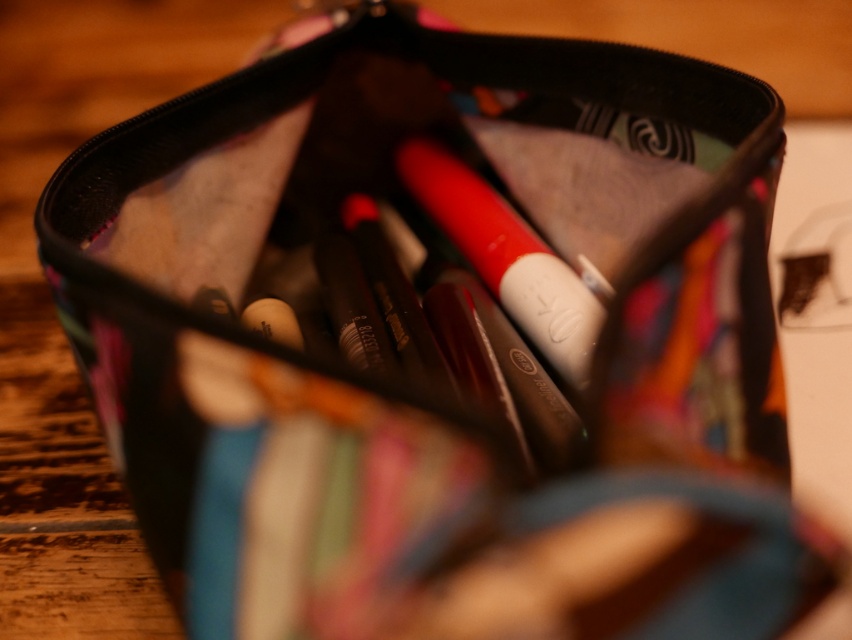
Is point (433, 172) less distant than point (283, 342)?

That is False.

Between point (471, 230) and point (280, 300), which one is positioned in front?

Point (280, 300)

Who is more forward, (521, 268) or (296, 323)?

Point (296, 323) is more forward.

The height and width of the screenshot is (640, 852). Find the location of `matte white lipstick at center`. matte white lipstick at center is located at coordinates (505, 257).